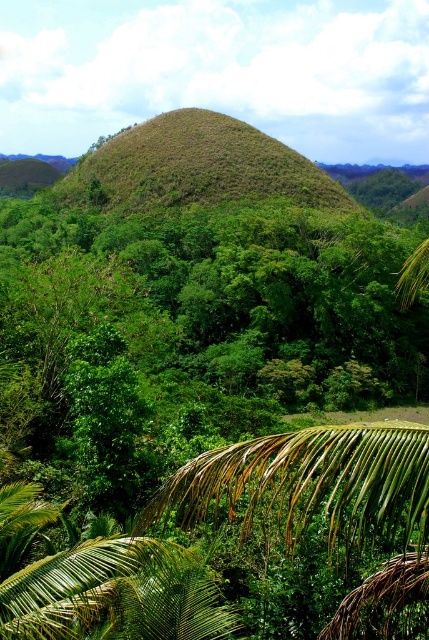
Question: Which point is closer to the camera?

Choices:
 (A) brown grassy hill at center
 (B) green leafy palm at lower center

Answer: (B)

Question: Is green leafy palm at lower center in front of brown grassy hill at center?

Choices:
 (A) no
 (B) yes

Answer: (B)

Question: Which point appears farthest from the camera in this image?

Choices:
 (A) (404, 515)
 (B) (111, 180)

Answer: (B)

Question: Is green leafy palm at lower center thinner than brown grassy hill at center?

Choices:
 (A) no
 (B) yes

Answer: (B)

Question: Can you confirm if green leafy palm at lower center is smaller than brown grassy hill at center?

Choices:
 (A) yes
 (B) no

Answer: (A)